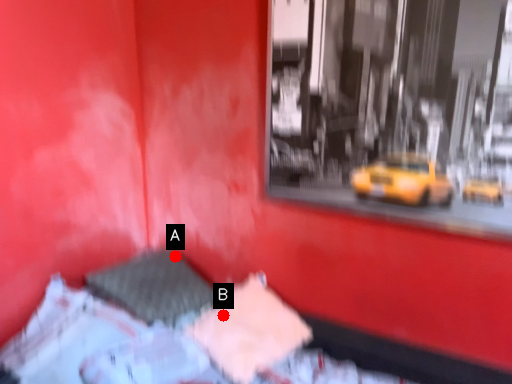
Question: Two points are circled on the image, labeled by A and B beside each circle. Which point is farther to the camera?

Choices:
 (A) A is further
 (B) B is further

Answer: (A)